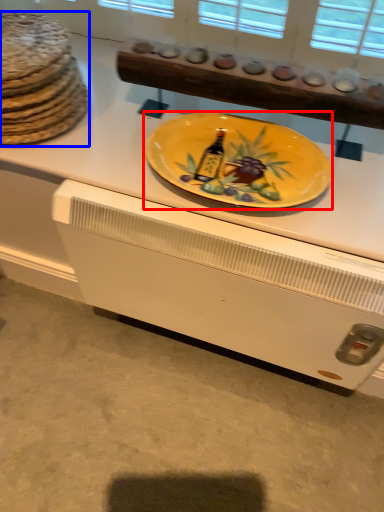
Question: Which of the following is the farthest to the observer, plate (highlighted by a red box) or chocolate cake (highlighted by a blue box)?

Choices:
 (A) plate
 (B) chocolate cake

Answer: (B)